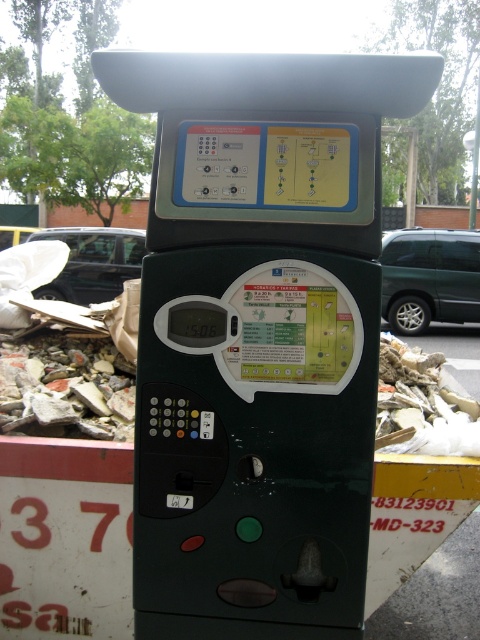
You are standing at the point labeled point [236,321] and want to take a photo of the parking meter. If your camera requires you to be at least 1.5 meters away to focus properly, will you be able to take a clear photo?

The distance between point [236,321] and the camera is 1.70 meters, which is more than the required 1.5 meters. Therefore, you can take a clear photo.

You are standing at the center of the image. Where exactly is the green matte parking meter at center located in terms of coordinates?

The green matte parking meter at center is located at coordinates point [259,337].